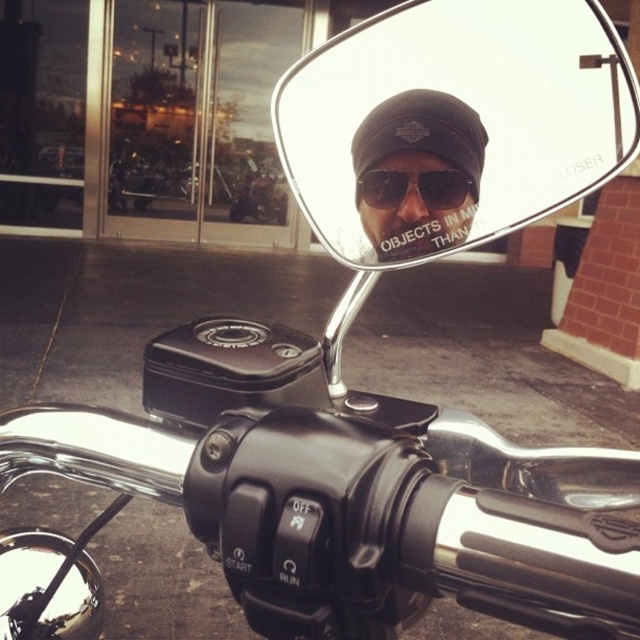
Does black reflective mirror at upper center appear over black matte sunglasses at center?

Yes.

Who is more distant from viewer, [348,248] or [433,200]?

The point [348,248] is behind.

Where is `black reflective mirror at upper center`? The width and height of the screenshot is (640, 640). black reflective mirror at upper center is located at coordinates (452, 124).

Does matte black cap at center appear on the left side of black matte sunglasses at center?

Indeed, matte black cap at center is positioned on the left side of black matte sunglasses at center.

Is matte black cap at center closer to camera compared to black matte sunglasses at center?

Yes, matte black cap at center is in front of black matte sunglasses at center.

At what (x,y) coordinates should I click in order to perform the action: click on matte black cap at center. Please return your answer as a coordinate pair (x, y). This screenshot has height=640, width=640. Looking at the image, I should click on (417, 172).

Identify the location of matte black cap at center. Image resolution: width=640 pixels, height=640 pixels. [x=417, y=172].

Who is shorter, black reflective mirror at upper center or matte black cap at center?

Standing shorter between the two is matte black cap at center.

Which is behind, point (442, 10) or point (371, 189)?

Positioned behind is point (442, 10).

Find the location of `black reflective mirror at upper center`. black reflective mirror at upper center is located at coordinates (452, 124).